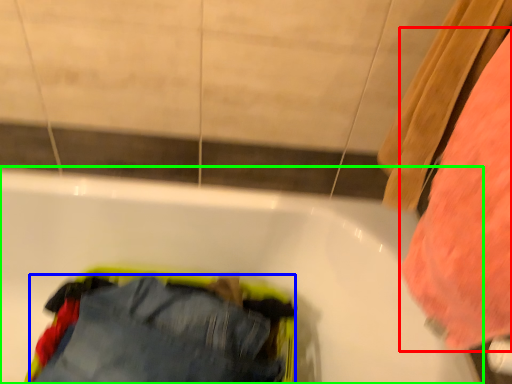
Question: Based on their relative distances, which object is nearer to clothing (highlighted by a red box)? Choose from trousers (highlighted by a blue box) and bathtub (highlighted by a green box).

Choices:
 (A) trousers
 (B) bathtub

Answer: (B)